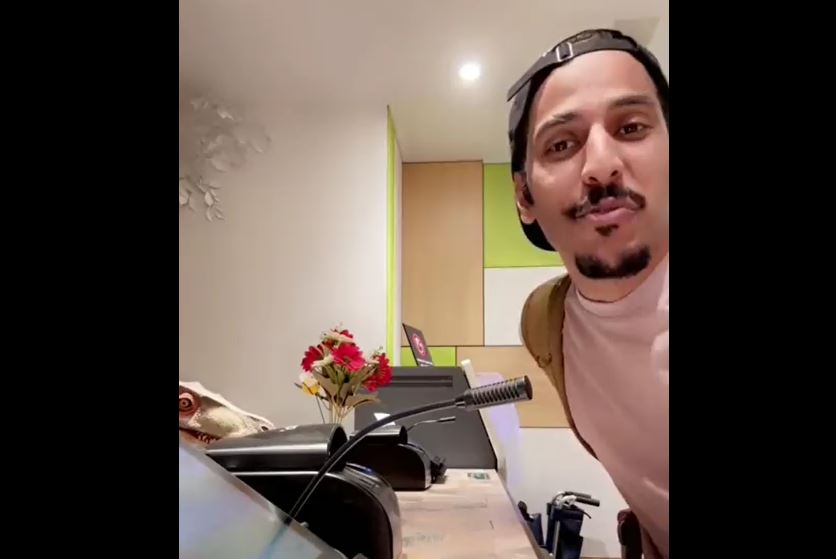
This screenshot has width=836, height=559. I want to click on decoration, so click(222, 155).